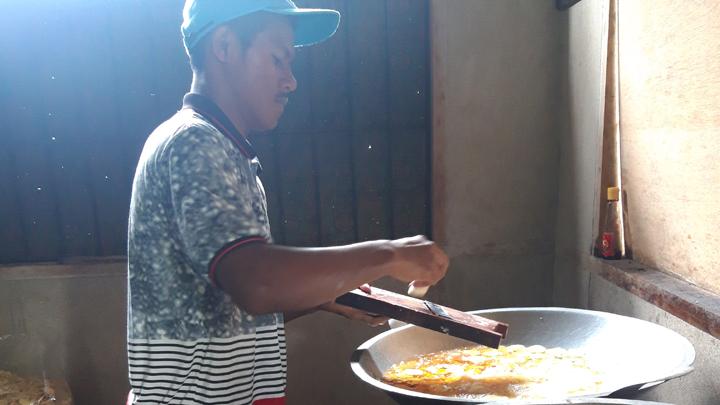
The width and height of the screenshot is (720, 405). In order to click on window sill in this screenshot , I will do `click(621, 265)`, `click(669, 286)`, `click(706, 303)`, `click(613, 276)`, `click(664, 302)`, `click(697, 321)`.